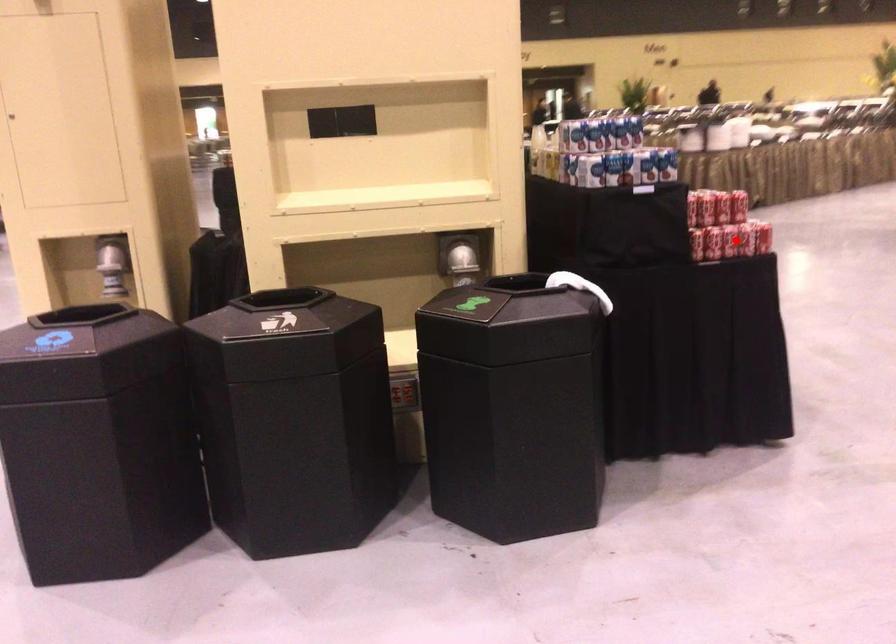
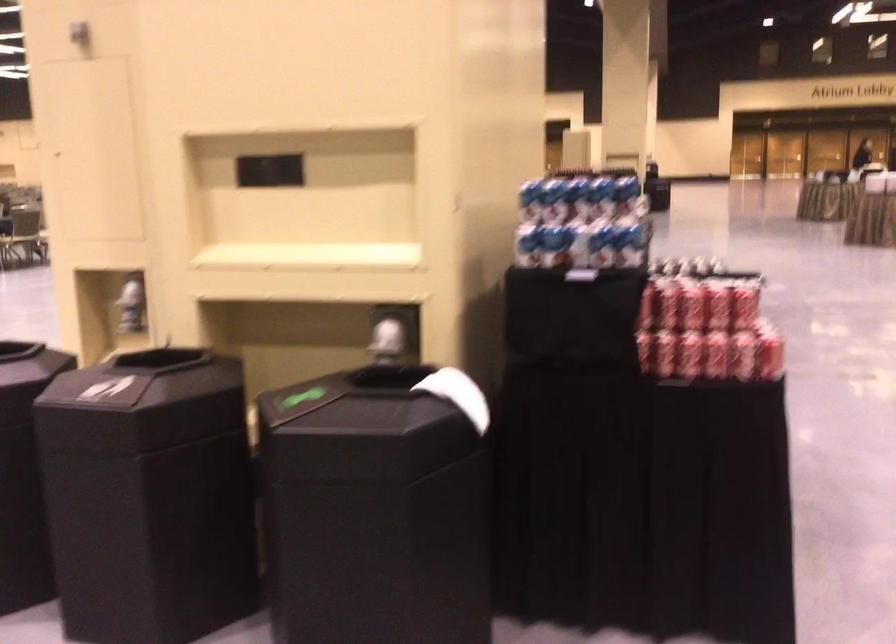
The point at the highlighted location is marked in the first image. Where is the corresponding point in the second image?

(716, 355)